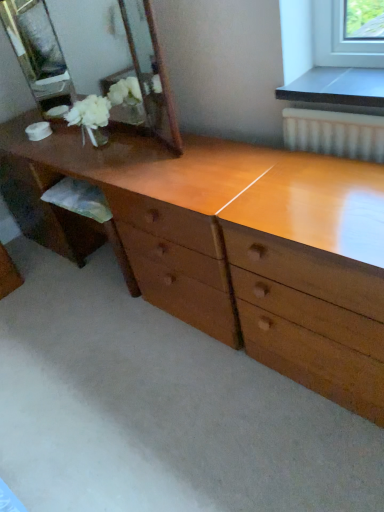
Question: Considering the positions of wooden mirror at upper left and wooden dresser at center in the image, is wooden mirror at upper left bigger or smaller than wooden dresser at center?

Choices:
 (A) small
 (B) big

Answer: (A)

Question: In terms of width, does wooden mirror at upper left look wider or thinner when compared to wooden dresser at center?

Choices:
 (A) wide
 (B) thin

Answer: (B)

Question: Relative to wooden dresser at center, is wooden mirror at upper left in front or behind?

Choices:
 (A) front
 (B) behind

Answer: (B)

Question: Is wooden dresser at center taller or shorter than wooden mirror at upper left?

Choices:
 (A) short
 (B) tall

Answer: (B)

Question: From a real-world perspective, is wooden dresser at center physically located above or below wooden mirror at upper left?

Choices:
 (A) above
 (B) below

Answer: (B)

Question: Considering the positions of wooden dresser at center and wooden mirror at upper left in the image, is wooden dresser at center bigger or smaller than wooden mirror at upper left?

Choices:
 (A) big
 (B) small

Answer: (A)

Question: Considering the relative positions of wooden dresser at center and wooden mirror at upper left in the image provided, is wooden dresser at center to the left or to the right of wooden mirror at upper left?

Choices:
 (A) left
 (B) right

Answer: (B)